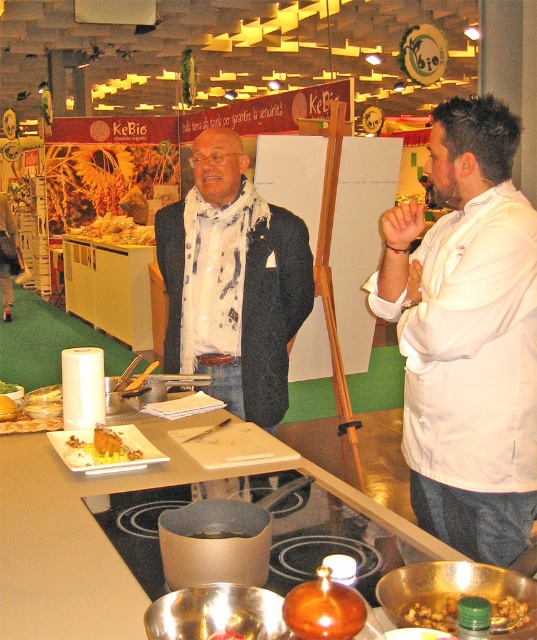
You are standing at the entrance of the room and want to place a new poster on the wall directly behind the dark gray woolen jacket at center. What coordinates should you aim for to ensure the poster is centered behind it?

To center the poster directly behind the dark gray woolen jacket at center, you should aim for the coordinates corresponding to its 2D location, which is at point (233,282).

You are a chef standing at the counter and need to reach the brown matte nuts at lower right. What are the coordinates of the nuts?

The brown matte nuts at lower right are located at coordinates point (431, 612).

You are a chef preparing to present a dish. You need to place the dark gray woolen jacket at center and the brown matte nuts at lower right on a shelf. The shelf has limited vertical space. Which item should you place first to ensure both fit vertically?

The dark gray woolen jacket at center should be placed first since it is located above the brown matte nuts at lower right, indicating it requires more vertical space above the nuts.